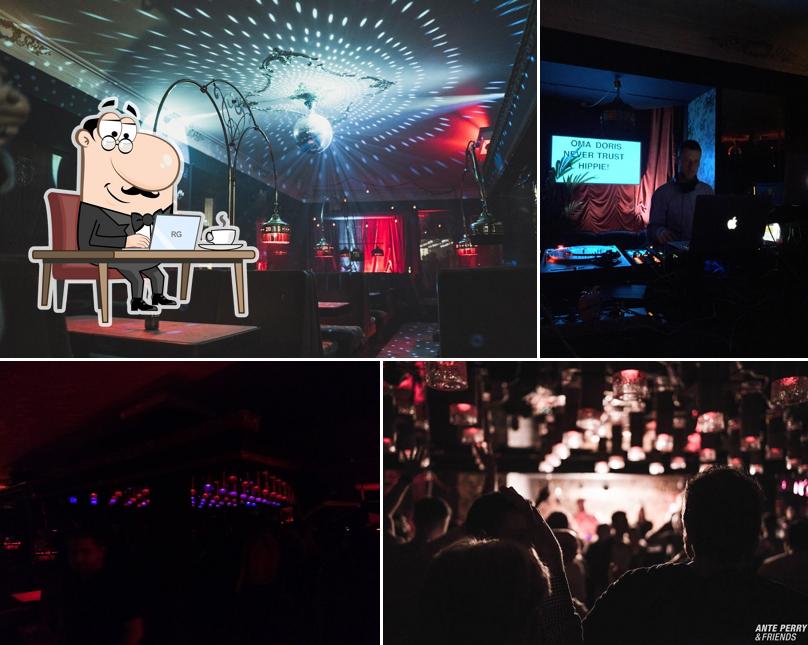
Identify the location of dj equipment. (620, 261).